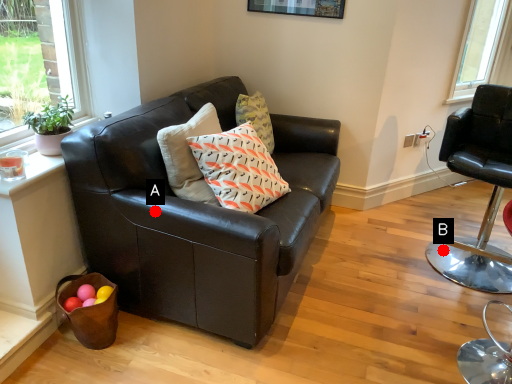
Question: Two points are circled on the image, labeled by A and B beside each circle. Among these points, which one is farthest from the camera?

Choices:
 (A) A is further
 (B) B is further

Answer: (B)